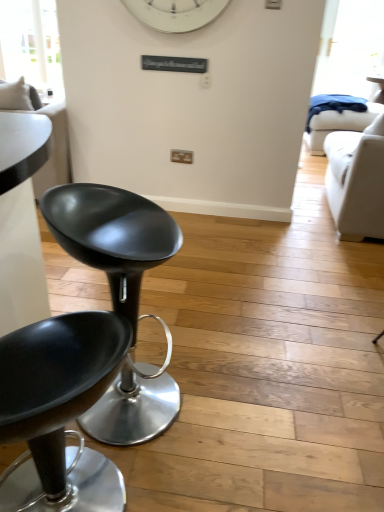
This screenshot has width=384, height=512. What do you see at coordinates (53, 147) in the screenshot?
I see `white fabric couch at left` at bounding box center [53, 147].

Describe the element at coordinates (356, 181) in the screenshot. This screenshot has width=384, height=512. I see `white leather couch at right` at that location.

What do you see at coordinates (112, 236) in the screenshot?
I see `matte black stool at left, which is the first chair from back to front` at bounding box center [112, 236].

Image resolution: width=384 pixels, height=512 pixels. What do you see at coordinates (31, 44) in the screenshot?
I see `transparent glass window at upper left` at bounding box center [31, 44].

In the scene shown: Measure the distance between transparent glass window at upper left and camera.

transparent glass window at upper left and camera are 4.06 meters apart from each other.

Describe the element at coordinates (60, 407) in the screenshot. I see `matte black stool at left, positioned as the first chair in front-to-back order` at that location.

Identify the location of white fabric couch at left. The image size is (384, 512). (53, 147).

Is white fabric couch at left placed right next to matte black stool at left, positioned as the first chair in front-to-back order?

There is a gap between white fabric couch at left and matte black stool at left, positioned as the first chair in front-to-back order.

Considering the relative sizes of white fabric couch at left and matte black stool at left, acting as the 2th chair starting from the back, in the image provided, is white fabric couch at left shorter than matte black stool at left, acting as the 2th chair starting from the back,?

No, white fabric couch at left is not shorter than matte black stool at left, acting as the 2th chair starting from the back.

Can we say white fabric couch at left lies outside matte black stool at left, acting as the 2th chair starting from the back?

Indeed, white fabric couch at left is completely outside matte black stool at left, acting as the 2th chair starting from the back.

From a real-world perspective, who is located lower, white fabric couch at left or matte black stool at left, positioned as the first chair in front-to-back order?

In real-world perspective, matte black stool at left, positioned as the first chair in front-to-back order, is lower.

Is point (134, 308) closer or farther from the camera than point (8, 7)?

Point (134, 308) is closer to the camera than point (8, 7).

Is the depth of matte black stool at left, arranged as the 2th chair when viewed from the front, greater than that of transparent glass window at upper left?

No, it is not.

From a real-world perspective, is matte black stool at left, which is the first chair from back to front, above or below transparent glass window at upper left?

matte black stool at left, which is the first chair from back to front, is situated lower than transparent glass window at upper left in the real world.

From the picture: Is matte black stool at left, which is the first chair from back to front, facing towards transparent glass window at upper left?

No, matte black stool at left, which is the first chair from back to front, does not turn towards transparent glass window at upper left.

In the image, is transparent glass window at upper left positioned in front of or behind white leather couch at right?

Visually, transparent glass window at upper left is located behind white leather couch at right.

Is transparent glass window at upper left with white leather couch at right?

No, transparent glass window at upper left is not beside white leather couch at right.

From the image's perspective, is transparent glass window at upper left located beneath white leather couch at right?

No, from the image's perspective, transparent glass window at upper left is not below white leather couch at right.

How different are the orientations of transparent glass window at upper left and white leather couch at right in degrees?

The angle between the facing direction of transparent glass window at upper left and the facing direction of white leather couch at right is 179 degrees.

Which of these two, white fabric couch at left or transparent glass window at upper left, is wider?

white fabric couch at left is wider.

Does white fabric couch at left have a lesser height compared to transparent glass window at upper left?

Yes.

From a real-world perspective, is white fabric couch at left beneath transparent glass window at upper left?

Yes, from a real-world perspective, white fabric couch at left is beneath transparent glass window at upper left.

Is white fabric couch at left bigger than transparent glass window at upper left?

Yes.

Between point (368, 182) and point (105, 502), which one is positioned in front?

The point (105, 502) is more forward.

Considering the sizes of white leather couch at right and matte black stool at left, positioned as the first chair in front-to-back order, in the image, is white leather couch at right taller or shorter than matte black stool at left, positioned as the first chair in front-to-back order,?

In the image, white leather couch at right appears to be taller than matte black stool at left, positioned as the first chair in front-to-back order.

Which object is wider, white leather couch at right or matte black stool at left, positioned as the first chair in front-to-back order?

Wider between the two is white leather couch at right.

Is white leather couch at right placed right next to matte black stool at left, positioned as the first chair in front-to-back order?

No, white leather couch at right is not next to matte black stool at left, positioned as the first chair in front-to-back order.

How different are the orientations of matte black stool at left, acting as the 2th chair starting from the back, and white fabric couch at left in degrees?

matte black stool at left, acting as the 2th chair starting from the back, and white fabric couch at left are facing 42.3 degrees away from each other.

Between matte black stool at left, positioned as the first chair in front-to-back order, and white fabric couch at left, which one appears on the right side from the viewer's perspective?

From the viewer's perspective, matte black stool at left, positioned as the first chair in front-to-back order, appears more on the right side.

Between point (16, 425) and point (58, 160), which one is positioned behind?

The point (58, 160) is more distant.

Is white fabric couch at left spatially inside matte black stool at left, which is the first chair from back to front, or outside of it?

The correct answer is: outside.

Is white fabric couch at left taller than matte black stool at left, arranged as the 2th chair when viewed from the front?

Indeed, white fabric couch at left has a greater height compared to matte black stool at left, arranged as the 2th chair when viewed from the front.

From the image's perspective, which is above, white fabric couch at left or matte black stool at left, arranged as the 2th chair when viewed from the front?

white fabric couch at left is shown above in the image.

From the white fabric couch at left, count 1st chairs forward and point to it. Please provide its 2D coordinates.

[(112, 236)]

At what (x,y) coordinates should I click in order to perform the action: click on couch on the left of the matte black stool at left, positioned as the first chair in front-to-back order. Please return your answer as a coordinate pair (x, y). This screenshot has height=512, width=384. Looking at the image, I should click on (53, 147).

Where is `chair that is the 2nd one when counting rightward from the transparent glass window at upper left`? Image resolution: width=384 pixels, height=512 pixels. chair that is the 2nd one when counting rightward from the transparent glass window at upper left is located at coordinates (112, 236).

Looking at the image, which one is located further to white fabric couch at left, matte black stool at left, positioned as the first chair in front-to-back order, or transparent glass window at upper left?

transparent glass window at upper left is positioned further to the anchor white fabric couch at left.

Estimate the real-world distances between objects in this image. Which object is further from white leather couch at right, transparent glass window at upper left or matte black stool at left, arranged as the 2th chair when viewed from the front?

Among the two, transparent glass window at upper left is located further to white leather couch at right.

Which object lies further to the anchor point white fabric couch at left, white leather couch at right or matte black stool at left, acting as the 2th chair starting from the back?

white leather couch at right is further to white fabric couch at left.

Based on the photo, from the image, which object appears to be farther from white leather couch at right, matte black stool at left, which is the first chair from back to front, or matte black stool at left, positioned as the first chair in front-to-back order?

matte black stool at left, positioned as the first chair in front-to-back order, is further to white leather couch at right.

Based on their spatial positions, is white leather couch at right or matte black stool at left, arranged as the 2th chair when viewed from the front, further from transparent glass window at upper left?

matte black stool at left, arranged as the 2th chair when viewed from the front, is positioned further to the anchor transparent glass window at upper left.

Looking at the image, which one is located further to transparent glass window at upper left, matte black stool at left, positioned as the first chair in front-to-back order, or white leather couch at right?

matte black stool at left, positioned as the first chair in front-to-back order.

Which object lies further to the anchor point white fabric couch at left, matte black stool at left, acting as the 2th chair starting from the back, or matte black stool at left, which is the first chair from back to front?

matte black stool at left, acting as the 2th chair starting from the back, is positioned further to the anchor white fabric couch at left.

Based on their spatial positions, is white leather couch at right or white fabric couch at left further from transparent glass window at upper left?

white leather couch at right.

You are a GUI agent. You are given a task and a screenshot of the screen. Output one action in this format:
    pyautogui.click(x=<x>, y=<y>)
    Task: Click on the chair between matte black stool at left, positioned as the first chair in front-to-back order, and transparent glass window at upper left from front to back
    This screenshot has height=512, width=384.
    Given the screenshot: What is the action you would take?
    pyautogui.click(x=112, y=236)

The image size is (384, 512). Identify the location of studio couch between matte black stool at left, positioned as the first chair in front-to-back order, and transparent glass window at upper left from front to back. (356, 181).

I want to click on couch between matte black stool at left, positioned as the first chair in front-to-back order, and transparent glass window at upper left, along the z-axis, so click(x=53, y=147).

Identify the location of chair between matte black stool at left, positioned as the first chair in front-to-back order, and white fabric couch at left in the front-back direction. Image resolution: width=384 pixels, height=512 pixels. (112, 236).